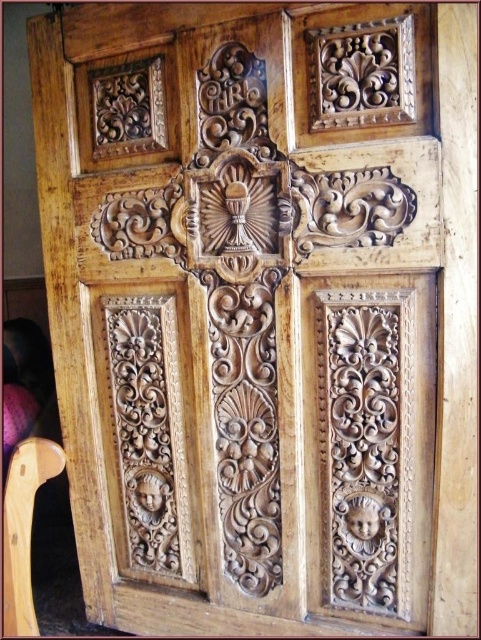
You are standing in front of the wooden panel and want to sit on the light brown wood chair at lower left. However, there is a light brown wood carving at lower left in your way. Can you reach the chair without moving the carving?

The light brown wood chair at lower left is behind the light brown wood carving at lower left, so you can reach the chair without moving the carving by going around it.